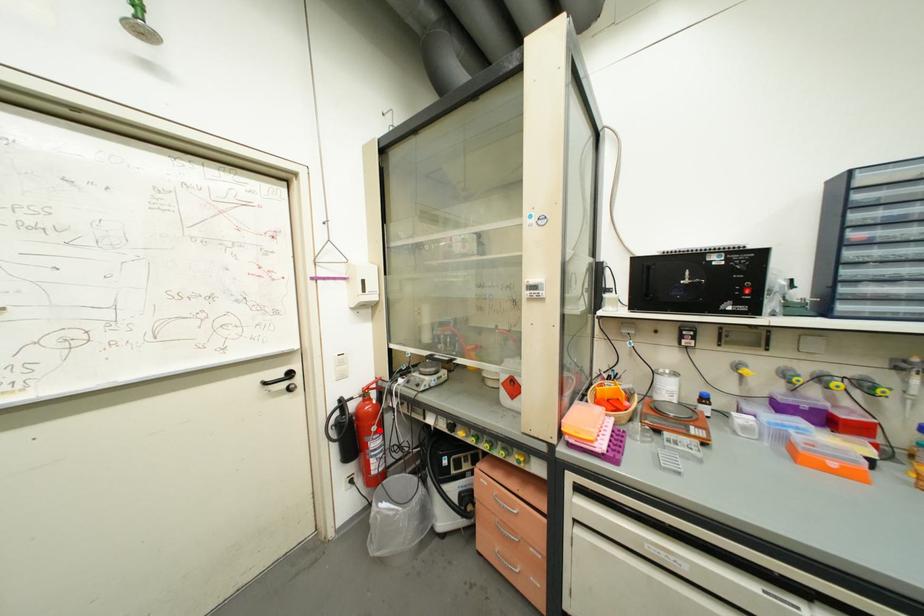
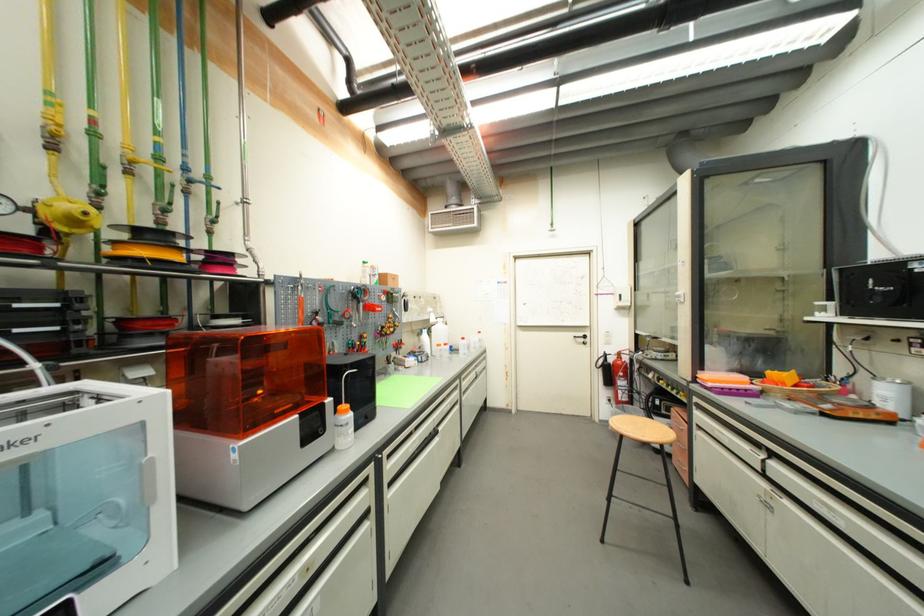
Question: I am providing you with two images of the same scene from different viewpoints. A red point is marked on the first image. Can you still see the location of the red point in image 2?

Choices:
 (A) Yes
 (B) No

Answer: (A)